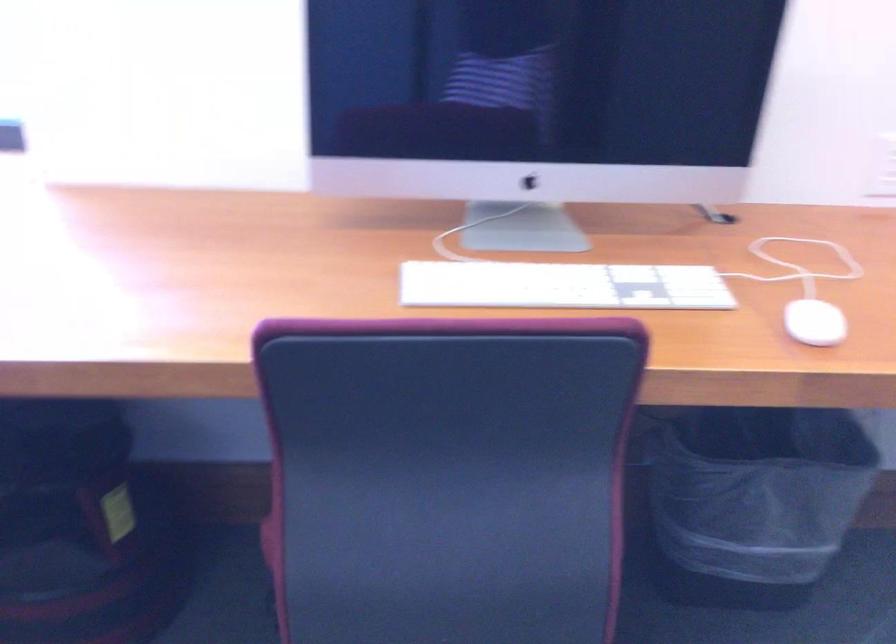
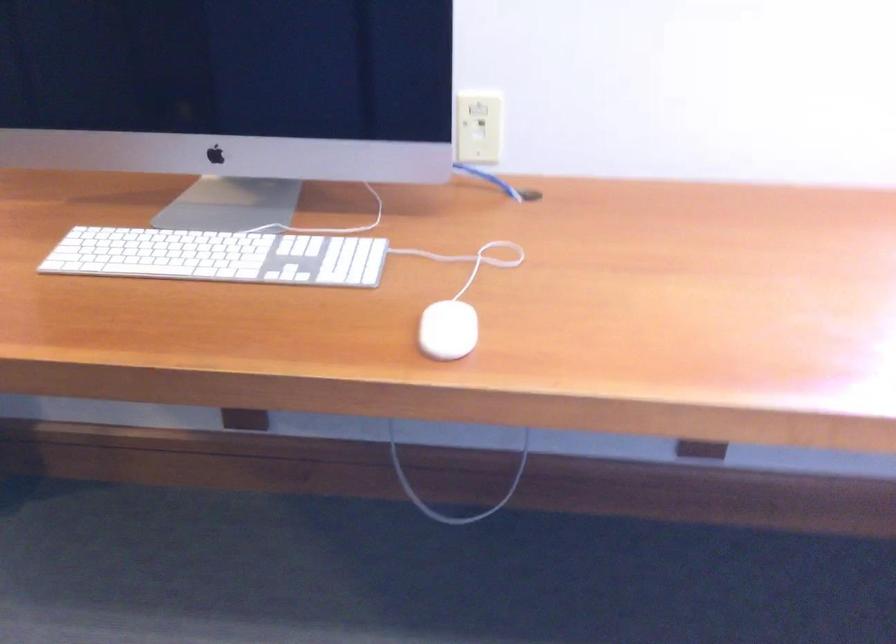
Question: What movement of the cameraman would produce the second image?

Choices:
 (A) Left
 (B) Right
 (C) Forward
 (D) Backward

Answer: (A)